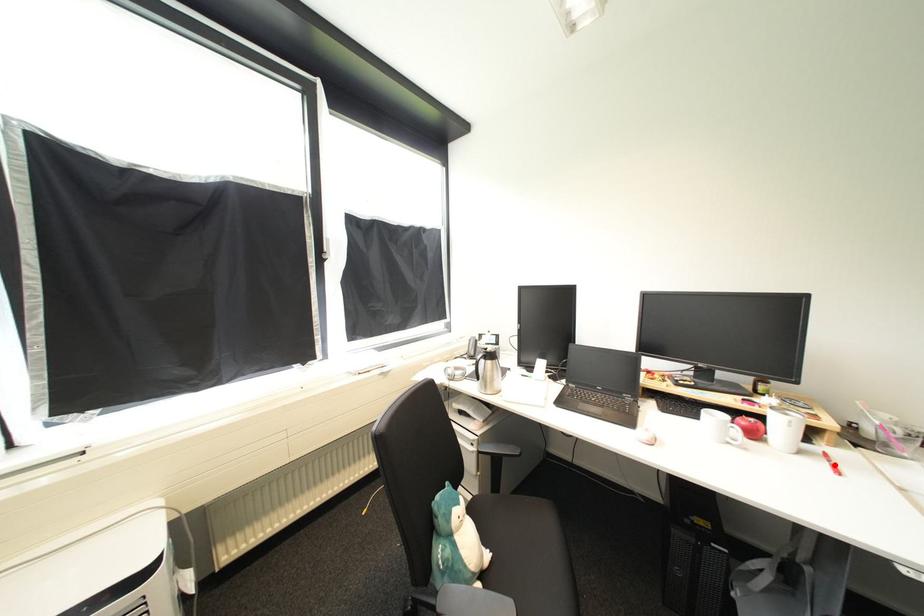
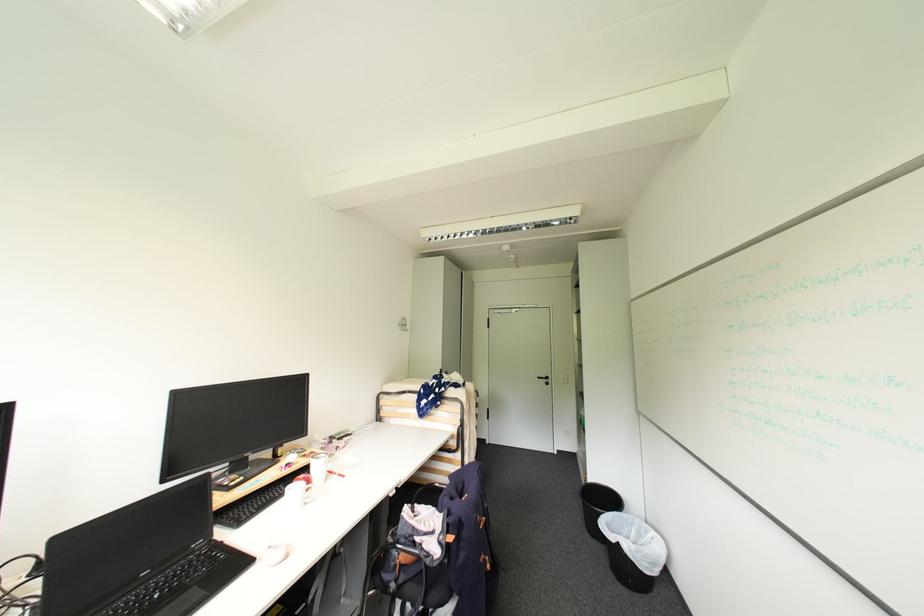
Find the pixel in the second image that matches the highlighted location in the first image.

(343, 477)